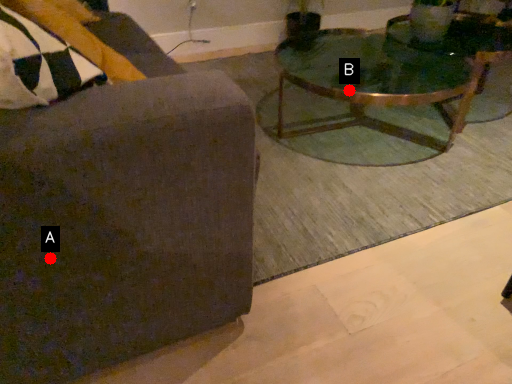
Question: Two points are circled on the image, labeled by A and B beside each circle. Which point is further to the camera?

Choices:
 (A) A is further
 (B) B is further

Answer: (B)